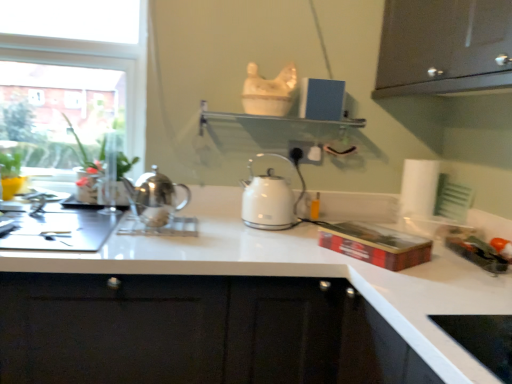
Identify the location of unoccupied area in front of white glossy kettle at center, the 2th kettle positioned from the front. The width and height of the screenshot is (512, 384). (268, 239).